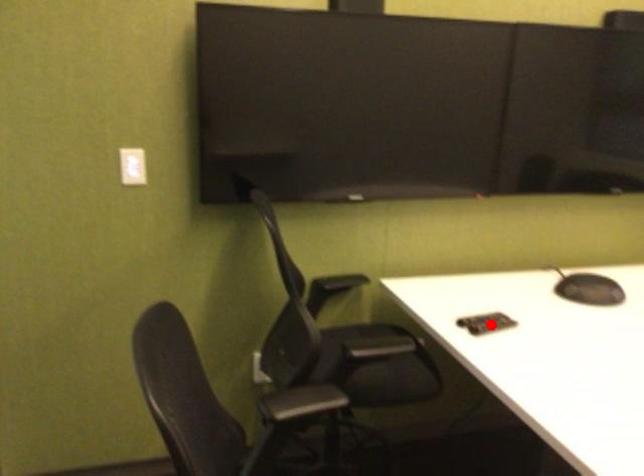
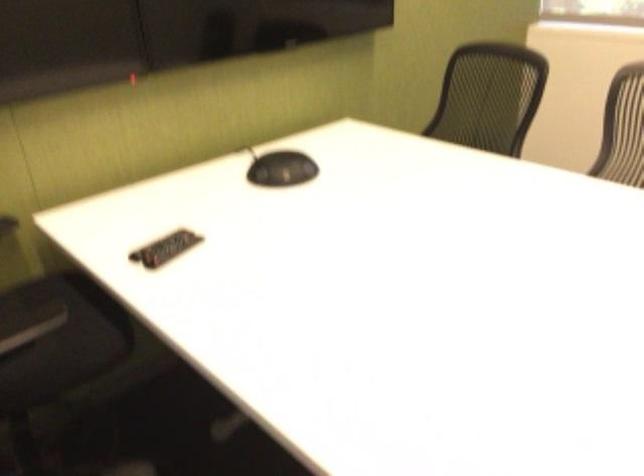
Where in the second image is the point corresponding to the highlighted location from the first image?

(165, 248)